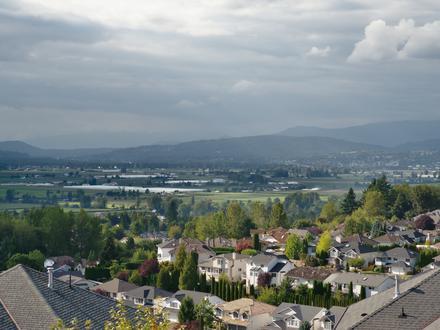
Where is `windows`? The image size is (440, 330). windows is located at coordinates (292, 323), (172, 304), (139, 302).